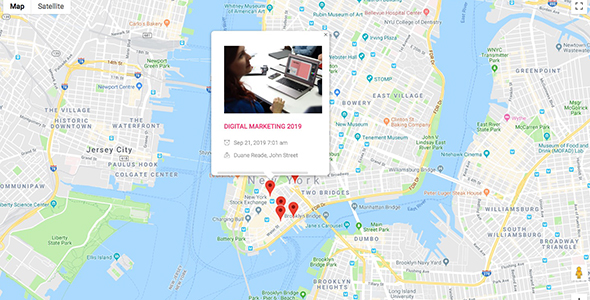
Identify the location of map. (17, 5).